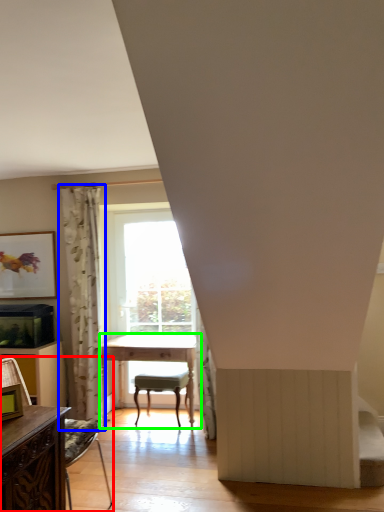
Question: Considering the real-world distances, which object is farthest from chair (highlighted by a red box)? curtain (highlighted by a blue box) or table (highlighted by a green box)?

Choices:
 (A) curtain
 (B) table

Answer: (A)